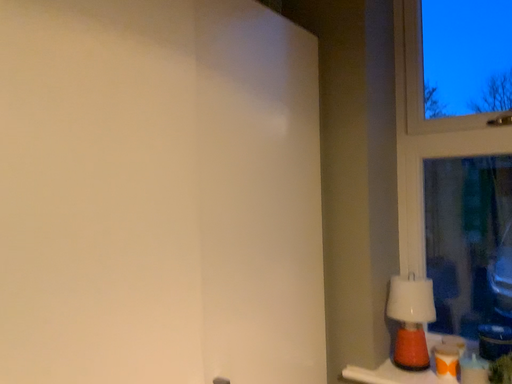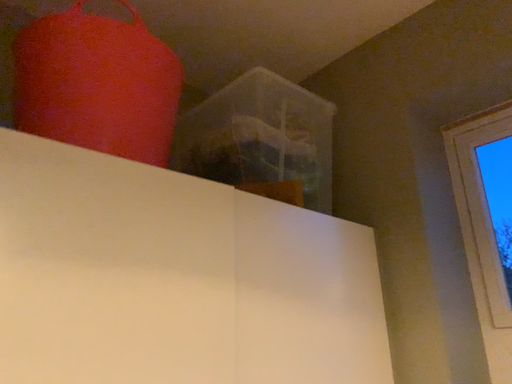
Question: Which way did the camera rotate in the video?

Choices:
 (A) rotated left
 (B) rotated right

Answer: (A)